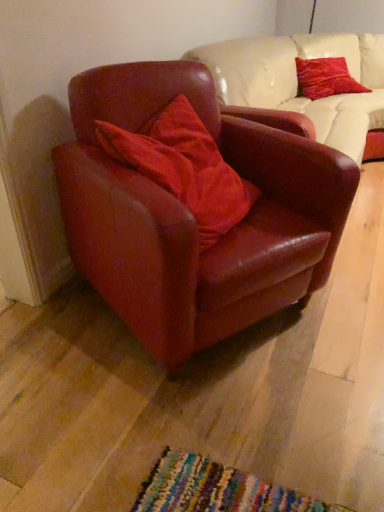
This screenshot has height=512, width=384. I want to click on free space in front of satin burgundy armchair at center, so click(x=196, y=425).